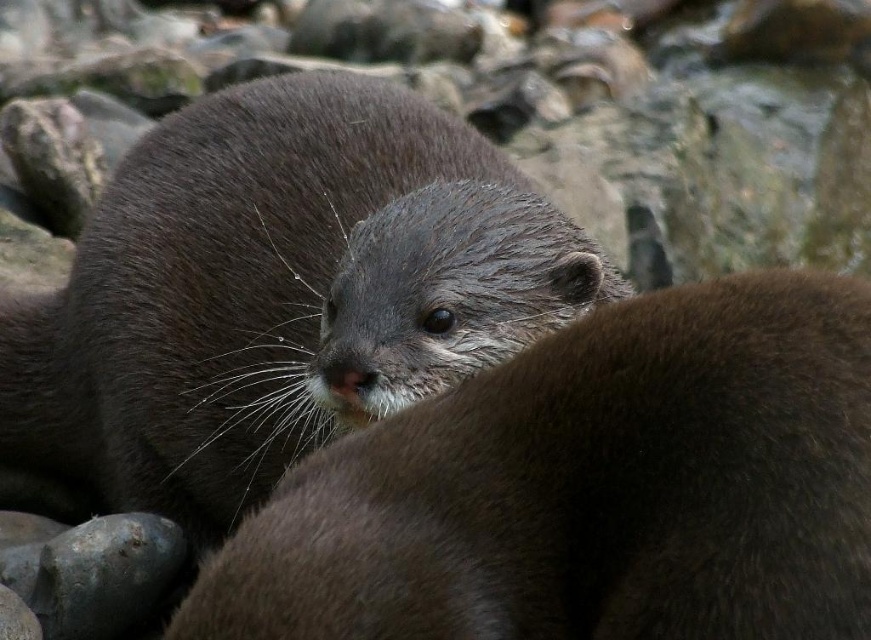
You are an animal caretaker observing two otters at the zoo. You need to determine which otter is smaller in width between the soft brown fur otter at center and the dark brown fur otter at center. Which one is smaller?

The soft brown fur otter at center is smaller in width than the dark brown fur otter at center according to the description.

You are a wildlife photographer trying to capture a closeup of the otters. Since you want to focus on the smaller one, which one should you aim your camera at between the soft brown fur otter at center and the dark brown fur otter at center?

The soft brown fur otter at center is smaller in size compared to the dark brown fur otter at center, so you should aim your camera at the soft brown fur otter at center to focus on the smaller one.

You are a wildlife photographer aiming to capture a closeup of the soft brown fur otter at center. Based on its coordinates, what is the best direction to move your camera to ensure it is centered in your viewfinder?

The soft brown fur otter at center is already at the coordinates point (591, 488), which is near the center of the image. Therefore, no significant adjustment is needed to center it in the viewfinder.